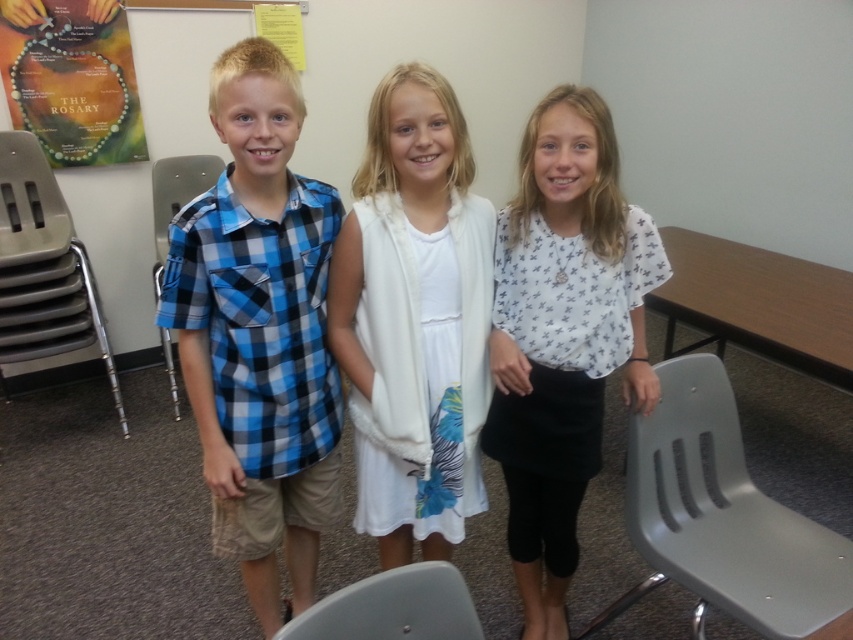
Question: Is blue plaid shirt at center further to the viewer compared to white printed blouse at center?

Choices:
 (A) yes
 (B) no

Answer: (B)

Question: Which object is farther from the camera taking this photo?

Choices:
 (A) matte paper poster at upper left
 (B) white fur vest at center
 (C) gray plastic chair at left
 (D) white printed blouse at center

Answer: (A)

Question: Which point is closer to the camera?

Choices:
 (A) gray plastic chair at lower right
 (B) blue plaid shirt at left

Answer: (A)

Question: Which point appears farthest from the camera in this image?

Choices:
 (A) (97, 323)
 (B) (685, 387)
 (C) (165, 211)
 (D) (579, 372)

Answer: (C)

Question: Observing the image, what is the correct spatial positioning of wooden table at right in reference to gray plastic chair at lower center?

Choices:
 (A) above
 (B) below

Answer: (A)

Question: From the image, what is the correct spatial relationship of white fur vest at center in relation to white printed blouse at center?

Choices:
 (A) left
 (B) right

Answer: (A)